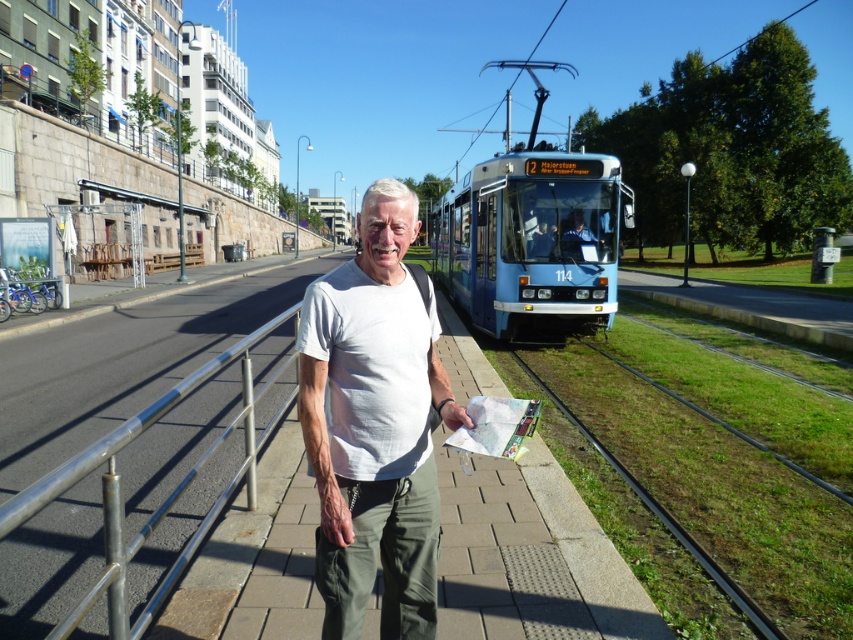
Is point (19, 352) more distant than point (364, 522)?

Yes, it is.

Between silver metallic rail at center and white cotton t-shirt at center, which one is positioned lower?

white cotton t-shirt at center is lower down.

The height and width of the screenshot is (640, 853). I want to click on silver metallic rail at center, so click(126, 362).